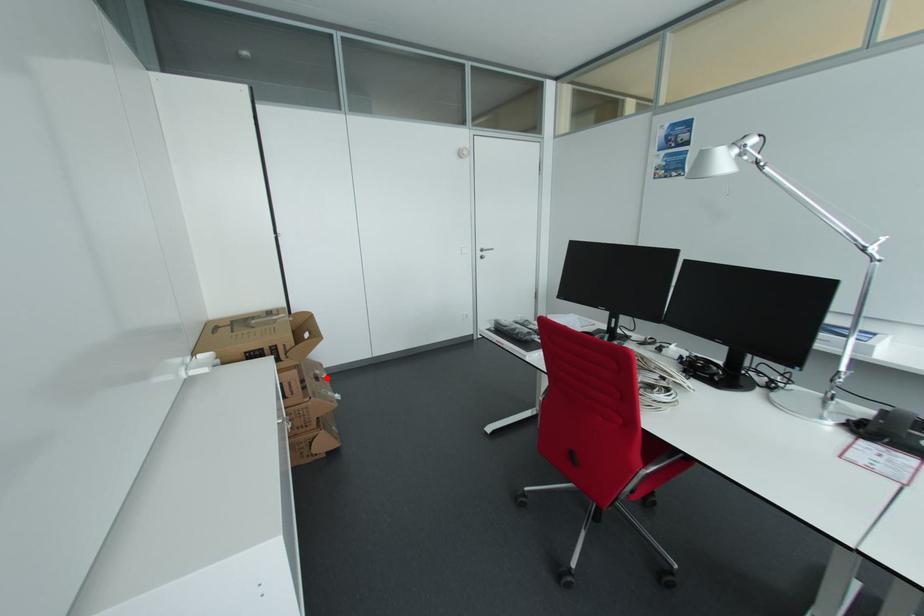
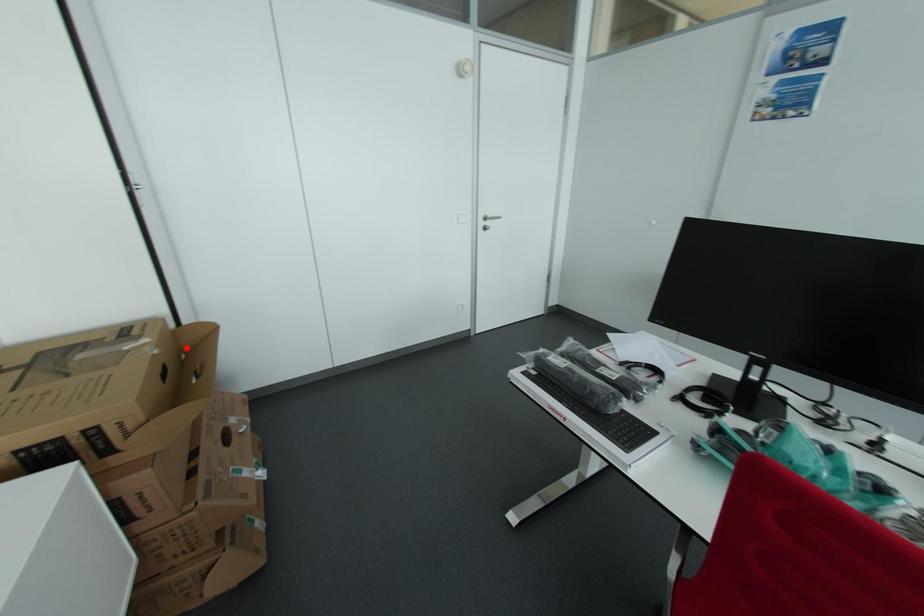
I am providing you with two images of the same scene from different viewpoints. A red point is marked on the first image and another point is marked on the second image. Do the highlighted points in image1 and image2 indicate the same real-world spot?

No